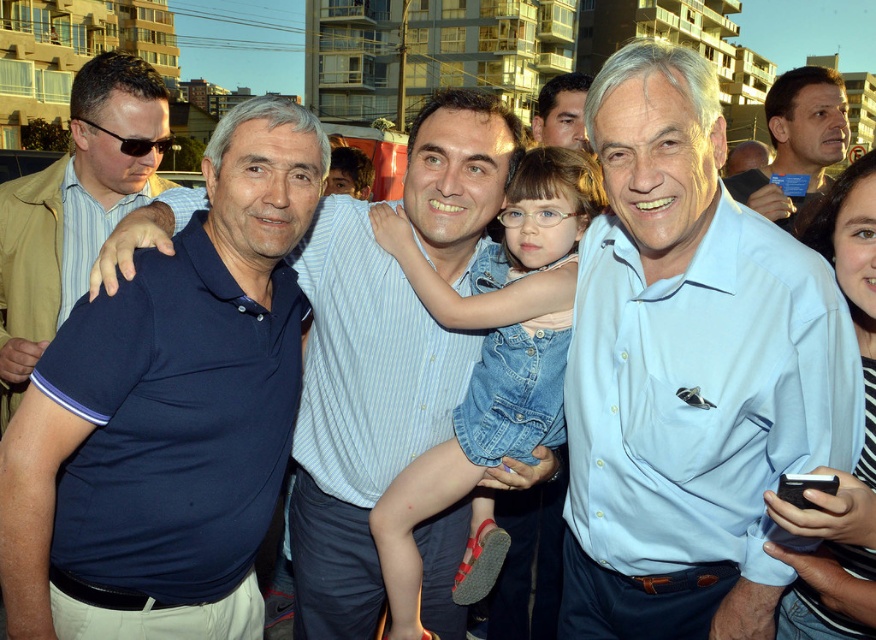
You are a photographer trying to capture a group photo of two men wearing dark blue polo shirts. The scene has the dark blue polo shirt at left and dark blue polo shirt at center. Given that your camera has a maximum focus range of 5 meters, can you capture both subjects in focus without moving them?

The dark blue polo shirt at left and dark blue polo shirt at center are 5.11 meters apart from each other. Since the camera can only focus up to 5 meters, the distance between them exceeds the focus range, so you cannot capture both in focus without moving them.